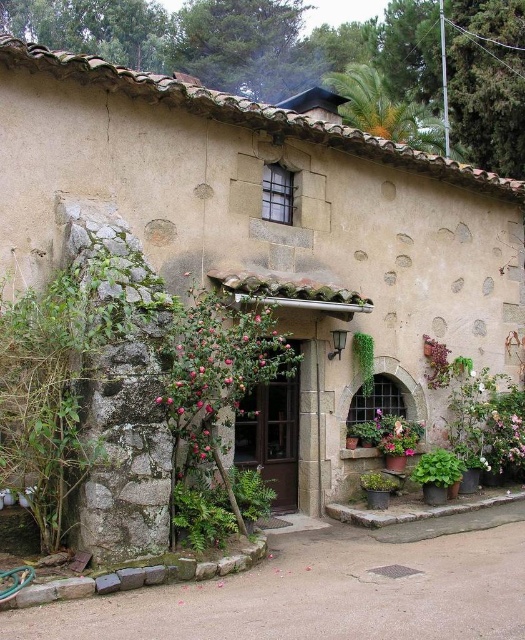
Question: Is green leafy plant at lower right closer to the viewer compared to green leafy plant at center?

Choices:
 (A) yes
 (B) no

Answer: (A)

Question: Which of these objects is positioned farthest from the green mossy stone wall at left?

Choices:
 (A) green leafy plant at lower right
 (B) green leafy plant at center
 (C) pink matte rose at center

Answer: (A)

Question: Estimate the real-world distances between objects in this image. Which object is closer to the pink matte rose at center?

Choices:
 (A) green leafy plant at lower right
 (B) green leafy plant at center
 (C) green mossy stone wall at left

Answer: (C)

Question: Where is pink matte rose at center located in relation to green leafy plant at center in the image?

Choices:
 (A) right
 (B) left

Answer: (B)

Question: Considering the real-world distances, which object is farthest from the green leafy plant at lower right?

Choices:
 (A) green leafy plant at center
 (B) pink matte rose at center
 (C) green mossy stone wall at left

Answer: (C)

Question: Does pink matte rose at center have a lesser width compared to green leafy plant at lower right?

Choices:
 (A) yes
 (B) no

Answer: (B)